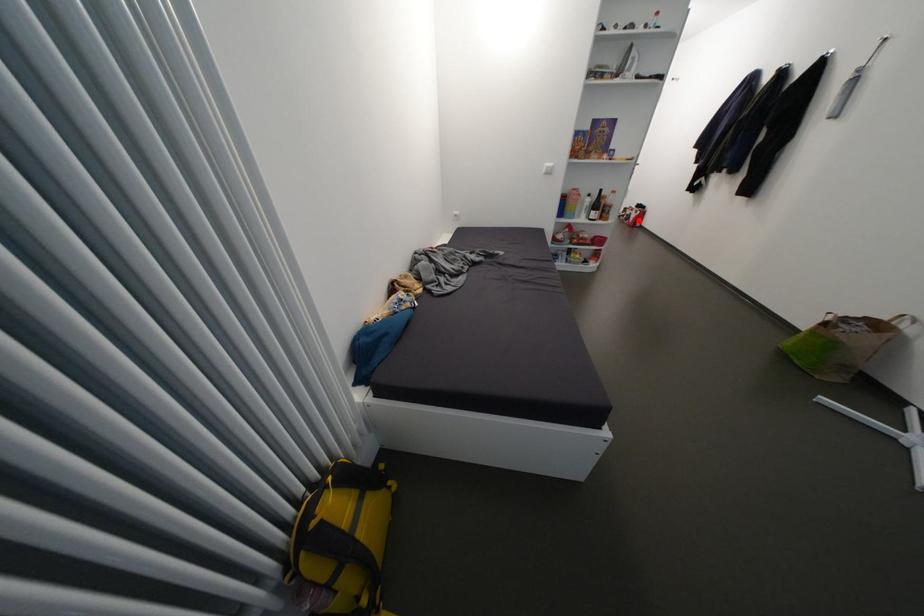
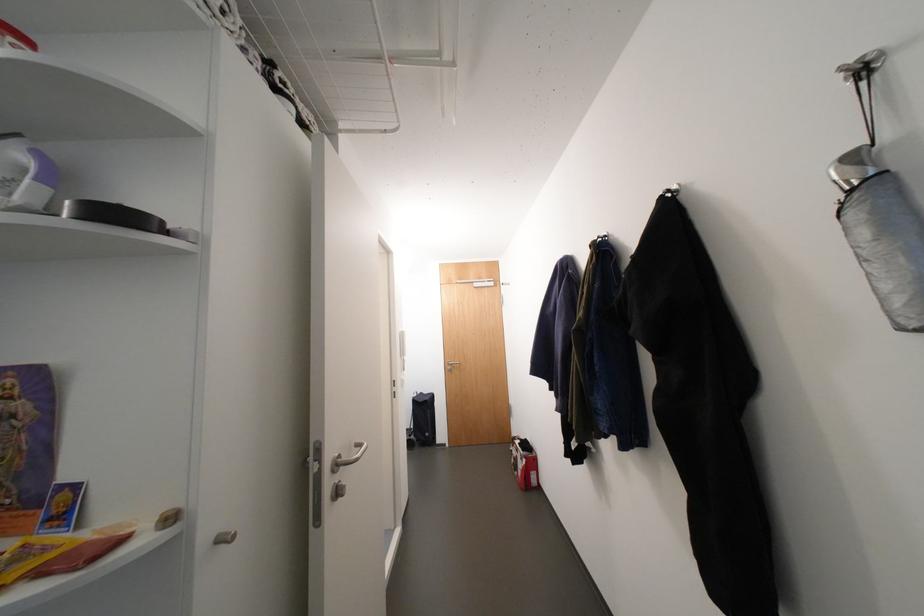
Question: I am providing you with two images of the same scene from different viewpoints. A red point is shown in image1. For the corresponding object point in image2, is it positioned nearer or farther from the camera?

Choices:
 (A) Nearer
 (B) Farther

Answer: (A)